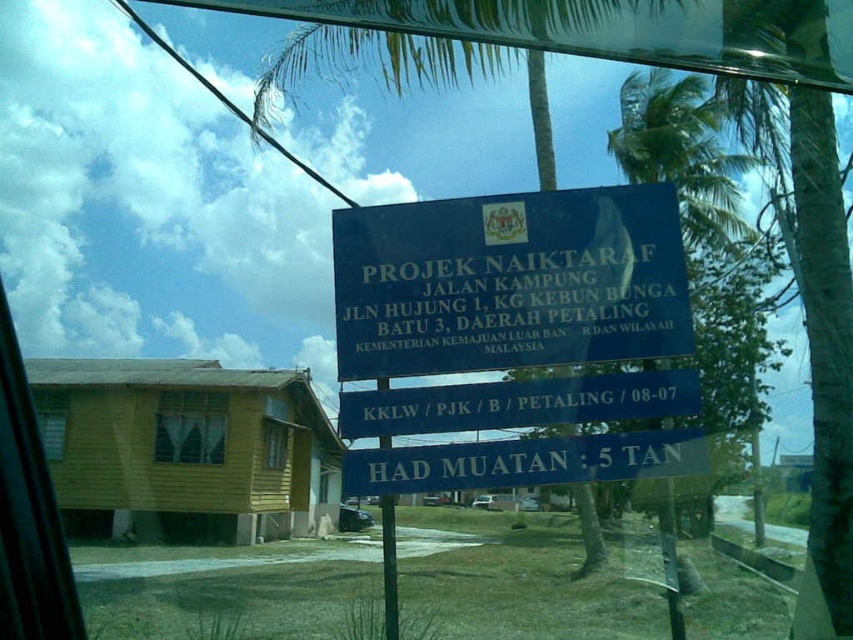
What are the coordinates of the blue metallic sign at center?

The coordinates of the blue metallic sign at center are (509, 282).

From the picture: You are standing in front of a window and see a blue metallic sign at center and a green painted wood pole at center. Which object is closer to you?

Result: The blue metallic sign at center is closer to you because it is positioned further to the viewer than the green painted wood pole at center.

You are a delivery person trying to attach a package to the green painted wood pole at center. However, there is a blue metallic sign at center in the way. Can you place the package directly on the pole without moving the sign?

The blue metallic sign at center is positioned over the green painted wood pole at center, so you cannot place the package directly on the pole without moving the sign.